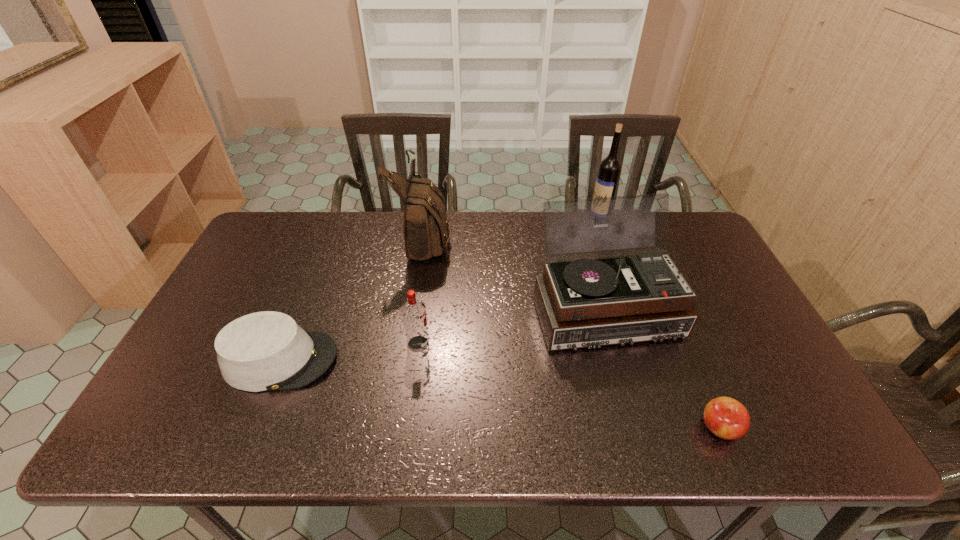
Identify the location of free space located on the label of the wine bottle. (482, 221).

Where is `free region located 0.370m on the front-facing side of the shoulder bag`? free region located 0.370m on the front-facing side of the shoulder bag is located at coordinates (561, 239).

The width and height of the screenshot is (960, 540). Find the location of `vacant region located on the front of the record player`. vacant region located on the front of the record player is located at coordinates (625, 382).

This screenshot has width=960, height=540. In order to click on vacant area situated 0.330m on the front label of the vodka in this screenshot , I will do `click(555, 344)`.

You are a GUI agent. You are given a task and a screenshot of the screen. Output one action in this format:
    pyautogui.click(x=<x>, y=<y>)
    Task: Click on the vacant region located 0.230m on the front-facing side of the hat
    The width and height of the screenshot is (960, 540).
    Given the screenshot: What is the action you would take?
    pyautogui.click(x=428, y=360)

The height and width of the screenshot is (540, 960). In order to click on vacant space located on the left of the nearest object in this screenshot , I will do `click(597, 428)`.

Find the location of a particular element. wine bottle at the far edge is located at coordinates (610, 167).

Where is `shoulder bag present at the far edge`? The height and width of the screenshot is (540, 960). shoulder bag present at the far edge is located at coordinates (425, 230).

At what (x,y) coordinates should I click in order to perform the action: click on object that is at the near edge. Please return your answer as a coordinate pair (x, y). Looking at the image, I should click on (725, 417).

The image size is (960, 540). What are the coordinates of `object at the left edge` in the screenshot? It's located at (264, 351).